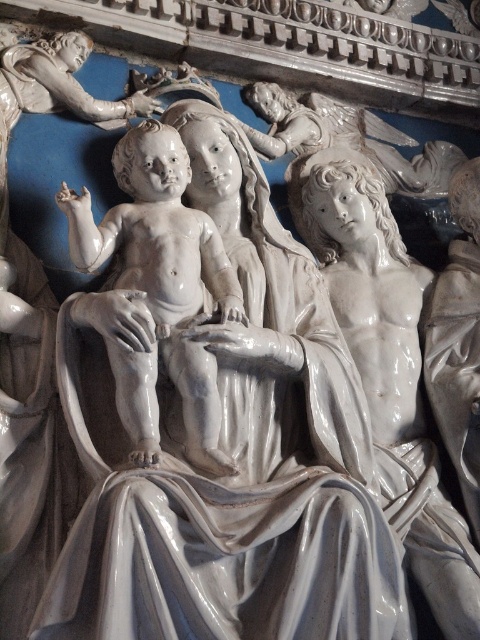
In the sculpture, you notice a matte white baby at center and a glossy white statue at center. Which one has a greater width?

The matte white baby at center has a greater width than the glossy white statue at center.

Based on the sculpture description, which object is shorter between the matte white baby at center and the glossy white statue at center?

The matte white baby at center is shorter than the glossy white statue at center.